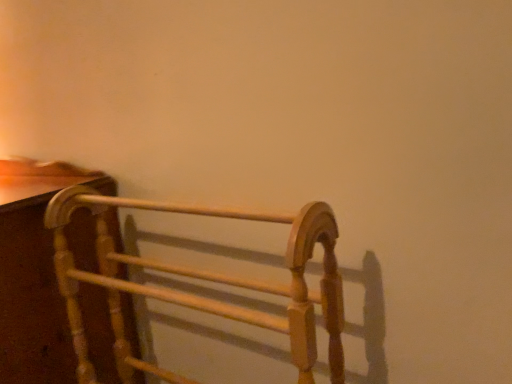
Question: In the image, is light brown wood towel rack at left, which is the 2th furniture in left-to-right order, positioned in front of or behind wooden towel rack at left, arranged as the 1th furniture when viewed from the left?

Choices:
 (A) front
 (B) behind

Answer: (A)

Question: Based on their positions, is light brown wood towel rack at left, which is the 2th furniture in left-to-right order, located to the left or right of wooden towel rack at left, placed as the second furniture when sorted from right to left?

Choices:
 (A) right
 (B) left

Answer: (A)

Question: Considering the positions of light brown wood towel rack at left, which is the 2th furniture in left-to-right order, and wooden towel rack at left, arranged as the 1th furniture when viewed from the left, in the image, is light brown wood towel rack at left, which is the 2th furniture in left-to-right order, taller or shorter than wooden towel rack at left, arranged as the 1th furniture when viewed from the left,?

Choices:
 (A) tall
 (B) short

Answer: (B)

Question: Is point (20, 357) closer or farther from the camera than point (77, 309)?

Choices:
 (A) farther
 (B) closer

Answer: (B)

Question: Relative to light brown wood towel rack at left, positioned as the first furniture in right-to-left order, is wooden towel rack at left, arranged as the 1th furniture when viewed from the left, in front or behind?

Choices:
 (A) front
 (B) behind

Answer: (B)

Question: Is wooden towel rack at left, placed as the second furniture when sorted from right to left, situated inside light brown wood towel rack at left, which is the 2th furniture in left-to-right order, or outside?

Choices:
 (A) inside
 (B) outside

Answer: (B)

Question: Looking at their shapes, would you say wooden towel rack at left, arranged as the 1th furniture when viewed from the left, is wider or thinner than light brown wood towel rack at left, which is the 2th furniture in left-to-right order?

Choices:
 (A) thin
 (B) wide

Answer: (B)